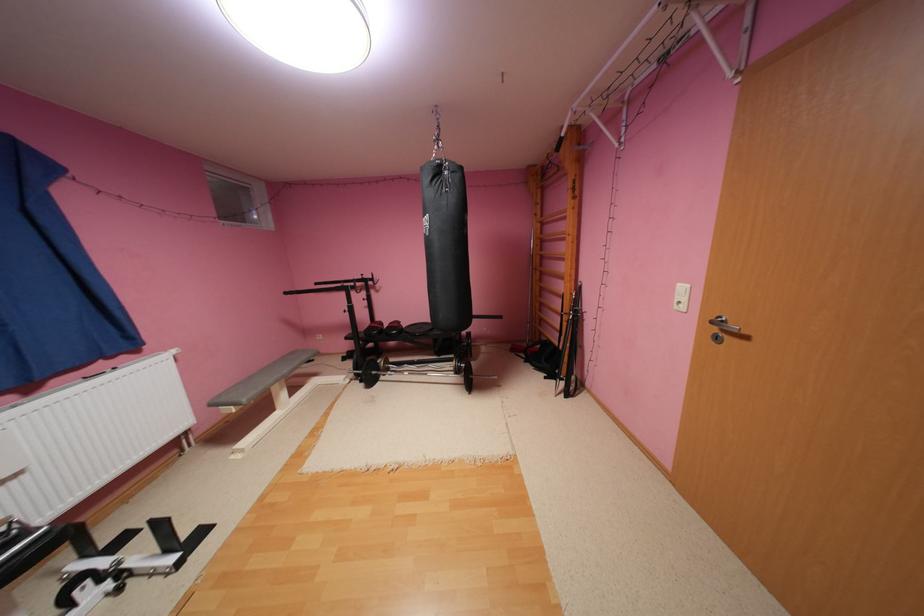
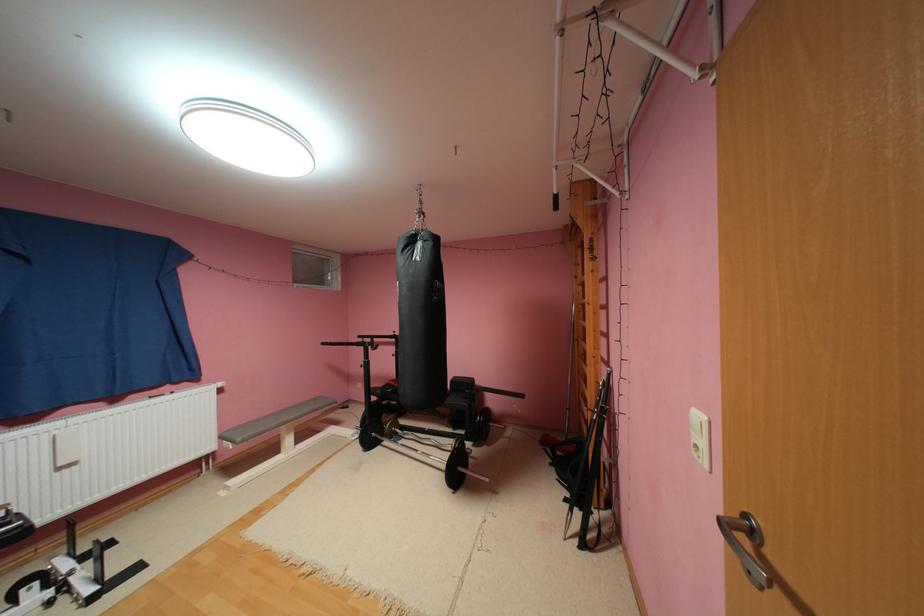
Locate, in the second image, the point that corresponds to [370,277] in the first image.

(400, 334)